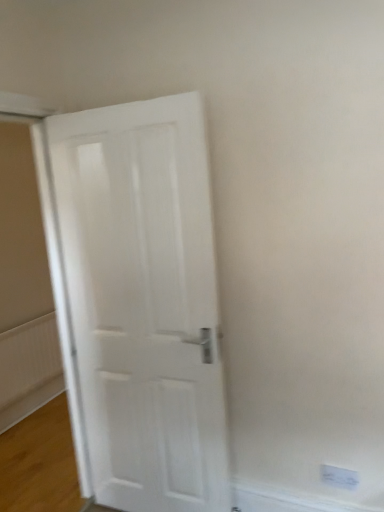
Question: Is white plastic electric outlet at lower right facing away from white matte door at center?

Choices:
 (A) yes
 (B) no

Answer: (B)

Question: Considering the relative sizes of white plastic electric outlet at lower right and white matte door at center in the image provided, is white plastic electric outlet at lower right thinner than white matte door at center?

Choices:
 (A) no
 (B) yes

Answer: (B)

Question: From the image's perspective, is white plastic electric outlet at lower right on white matte door at center?

Choices:
 (A) no
 (B) yes

Answer: (A)

Question: From the image's perspective, would you say white plastic electric outlet at lower right is shown under white matte door at center?

Choices:
 (A) yes
 (B) no

Answer: (A)

Question: From a real-world perspective, is white plastic electric outlet at lower right on white matte door at center?

Choices:
 (A) yes
 (B) no

Answer: (B)

Question: Is white plastic electric outlet at lower right positioned in front of white matte door at center?

Choices:
 (A) yes
 (B) no

Answer: (B)

Question: Is white matte door at center to the right of white textured radiator at lower left from the viewer's perspective?

Choices:
 (A) yes
 (B) no

Answer: (A)

Question: From the image's perspective, is white matte door at center located above white textured radiator at lower left?

Choices:
 (A) no
 (B) yes

Answer: (B)

Question: Considering the relative sizes of white matte door at center and white textured radiator at lower left in the image provided, is white matte door at center bigger than white textured radiator at lower left?

Choices:
 (A) yes
 (B) no

Answer: (A)

Question: From a real-world perspective, is white matte door at center on white textured radiator at lower left?

Choices:
 (A) no
 (B) yes

Answer: (B)

Question: Considering the relative sizes of white matte door at center and white textured radiator at lower left in the image provided, is white matte door at center wider than white textured radiator at lower left?

Choices:
 (A) yes
 (B) no

Answer: (A)

Question: Is white matte door at center positioned behind white textured radiator at lower left?

Choices:
 (A) yes
 (B) no

Answer: (B)

Question: Considering the relative positions of white textured radiator at lower left and white plastic electric outlet at lower right in the image provided, is white textured radiator at lower left in front of white plastic electric outlet at lower right?

Choices:
 (A) yes
 (B) no

Answer: (B)